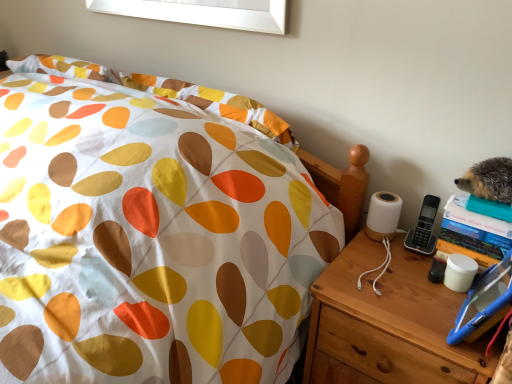
You are a GUI agent. You are given a task and a screenshot of the screen. Output one action in this format:
    pyautogui.click(x=<x>, y=<y>)
    Task: Click on the wooden nightstand at right
    Image resolution: width=512 pixels, height=384 pixels.
    Given the screenshot: What is the action you would take?
    pyautogui.click(x=389, y=323)

The width and height of the screenshot is (512, 384). What do you see at coordinates (389, 323) in the screenshot?
I see `wooden nightstand at right` at bounding box center [389, 323].

You are a GUI agent. You are given a task and a screenshot of the screen. Output one action in this format:
    pyautogui.click(x=<x>, y=<y>)
    Task: Click on the white fabric bed at center
    The image size is (512, 384).
    Given the screenshot: What is the action you would take?
    pyautogui.click(x=150, y=239)

What do you see at coordinates (150, 239) in the screenshot? This screenshot has width=512, height=384. I see `white fabric bed at center` at bounding box center [150, 239].

Find the location of `wooden nightstand at right`. wooden nightstand at right is located at coordinates (389, 323).

Considering the relative positions of white fabric bed at center and wooden nightstand at right in the image provided, is white fabric bed at center to the left of wooden nightstand at right from the viewer's perspective?

Correct, you'll find white fabric bed at center to the left of wooden nightstand at right.

Which object is closer to the camera taking this photo, white fabric bed at center or wooden nightstand at right?

Positioned in front is white fabric bed at center.

Is point (113, 304) closer to viewer compared to point (463, 344)?

That is False.

Based on the photo, from the image's perspective, which one is positioned lower, white fabric bed at center or wooden nightstand at right?

wooden nightstand at right is shown below in the image.

From a real-world perspective, which is physically below, white fabric bed at center or wooden nightstand at right?

In real-world perspective, wooden nightstand at right is lower.

Is white fabric bed at center wider than wooden nightstand at right?

Correct, the width of white fabric bed at center exceeds that of wooden nightstand at right.

Who is shorter, white fabric bed at center or wooden nightstand at right?

Standing shorter between the two is white fabric bed at center.

Looking at the image, does white fabric bed at center seem bigger or smaller compared to wooden nightstand at right?

Considering their sizes, white fabric bed at center takes up more space than wooden nightstand at right.

Is wooden nightstand at right completely or partially inside white fabric bed at center?

No, white fabric bed at center does not contain wooden nightstand at right.

Would you consider white fabric bed at center to be distant from wooden nightstand at right?

No, white fabric bed at center is not far from wooden nightstand at right.

Is white fabric bed at center oriented away from wooden nightstand at right?

white fabric bed at center does not have its back to wooden nightstand at right.

Measure the distance between white fabric bed at center and wooden nightstand at right.

white fabric bed at center and wooden nightstand at right are 32.92 centimeters apart.

The image size is (512, 384). In the image, there is a wooden nightstand at right. In order to click on bed above it (from the image's perspective) in this screenshot , I will do `click(150, 239)`.

Can you confirm if wooden nightstand at right is positioned to the right of white fabric bed at center?

Indeed, wooden nightstand at right is positioned on the right side of white fabric bed at center.

Who is more distant, wooden nightstand at right or white fabric bed at center?

wooden nightstand at right is behind.

Is point (448, 359) closer to viewer compared to point (222, 137)?

That is True.

From the image's perspective, does wooden nightstand at right appear lower than white fabric bed at center?

Yes, from the image's perspective, wooden nightstand at right is below white fabric bed at center.

From a real-world perspective, which object stands above the other?

white fabric bed at center, from a real-world perspective.

Is wooden nightstand at right wider or thinner than white fabric bed at center?

wooden nightstand at right is thinner than white fabric bed at center.

Which of these two, wooden nightstand at right or white fabric bed at center, stands shorter?

With less height is white fabric bed at center.

Can you confirm if wooden nightstand at right is smaller than white fabric bed at center?

Yes, wooden nightstand at right is smaller than white fabric bed at center.

In the scene shown: Is white fabric bed at center surrounded by wooden nightstand at right?

No, white fabric bed at center is not inside wooden nightstand at right.

Are wooden nightstand at right and white fabric bed at center making contact?

No, wooden nightstand at right is not with white fabric bed at center.

Is wooden nightstand at right oriented towards white fabric bed at center?

No, wooden nightstand at right is not facing towards white fabric bed at center.

Measure the distance from wooden nightstand at right to white fabric bed at center.

wooden nightstand at right is 32.92 centimeters away from white fabric bed at center.

This screenshot has height=384, width=512. What are the coordinates of `nightstand below the white fabric bed at center (from the image's perspective)` in the screenshot? It's located at (389, 323).

Where is `bed to the left of wooden nightstand at right`? This screenshot has height=384, width=512. bed to the left of wooden nightstand at right is located at coordinates (150, 239).

Locate an element on the screen. This screenshot has height=384, width=512. bed that appears above the wooden nightstand at right (from the image's perspective) is located at coordinates (150, 239).